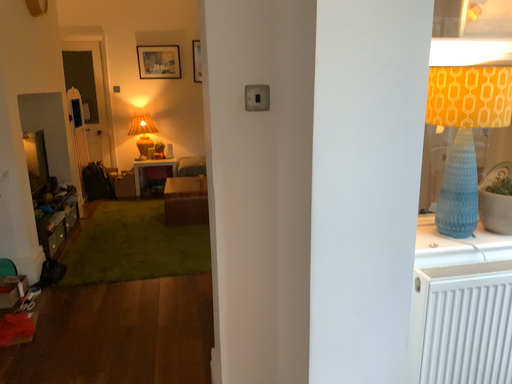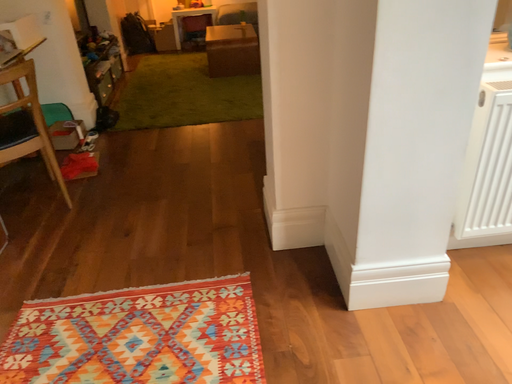
Question: How did the camera likely rotate when shooting the video?

Choices:
 (A) rotated downward
 (B) rotated upward

Answer: (A)